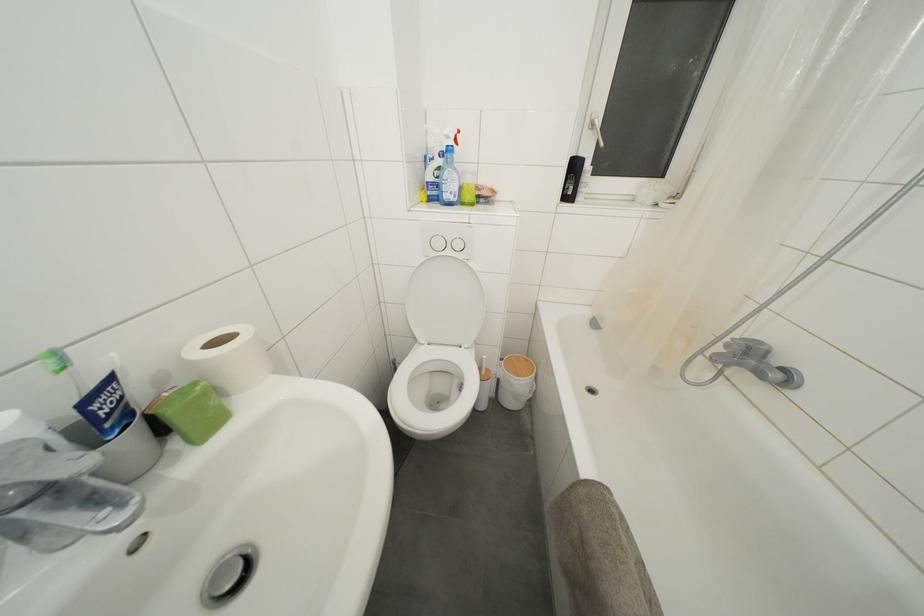
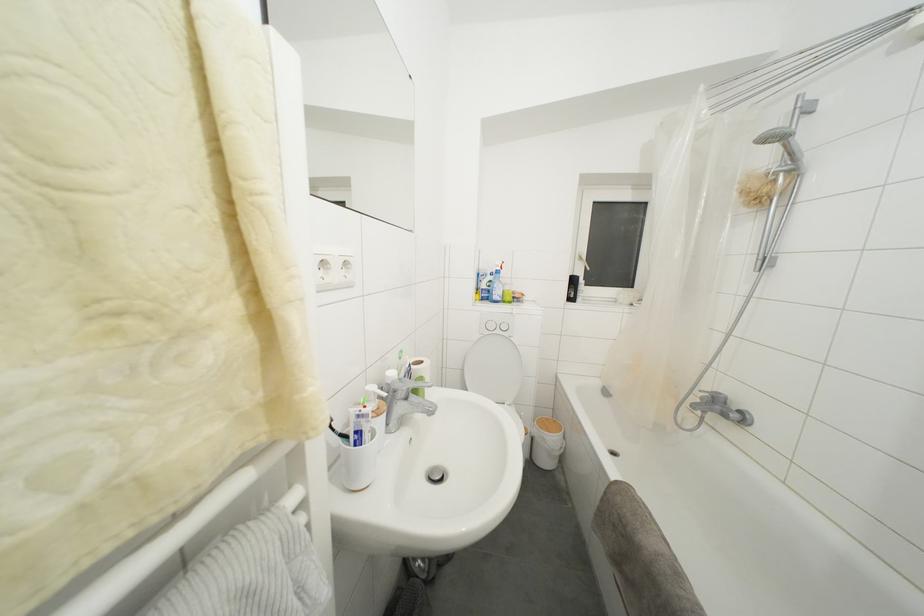
The point at (438, 199) is marked in the first image. Where is the corresponding point in the second image?

(490, 301)